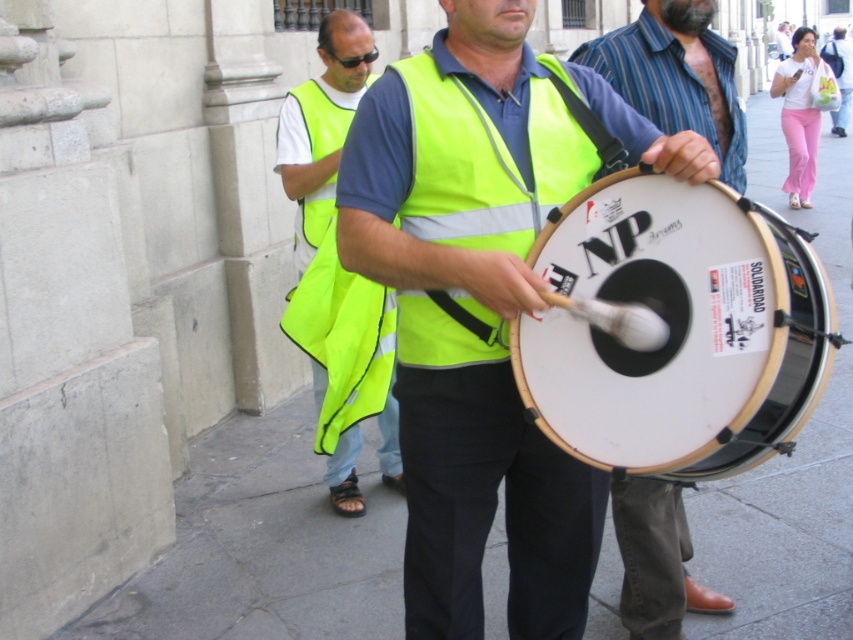
Who is lower down, high-visibility fabric safety vest at center or neon yellow vest at center?

Positioned lower is high-visibility fabric safety vest at center.

Who is more forward, (427,225) or (346,96)?

Point (427,225) is more forward.

Image resolution: width=853 pixels, height=640 pixels. I want to click on high-visibility fabric safety vest at center, so click(x=494, y=157).

The image size is (853, 640). I want to click on high-visibility fabric safety vest at center, so click(x=494, y=157).

Can you confirm if high visibility fabric safety vest at center is positioned to the left of black plastic goggles at center?

Yes, high visibility fabric safety vest at center is to the left of black plastic goggles at center.

This screenshot has height=640, width=853. Describe the element at coordinates (321, 118) in the screenshot. I see `high visibility fabric safety vest at center` at that location.

Where is `high visibility fabric safety vest at center`? Image resolution: width=853 pixels, height=640 pixels. high visibility fabric safety vest at center is located at coordinates (321, 118).

Can you confirm if white matte drum at center is positioned above matte yellow vest at center?

Yes.

At what (x,y) coordinates should I click in order to perform the action: click on white matte drum at center. Please return your answer as a coordinate pair (x, y). The width and height of the screenshot is (853, 640). Looking at the image, I should click on (676, 330).